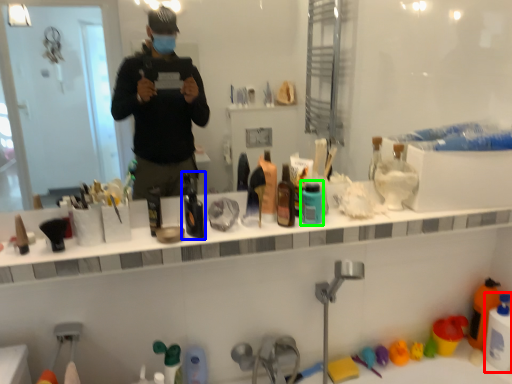
Question: Estimate the real-world distances between objects in this image. Which object is closer to cleaning product (highlighted by a red box), bottle (highlighted by a blue box) or mouthwash (highlighted by a green box)?

Choices:
 (A) bottle
 (B) mouthwash

Answer: (B)